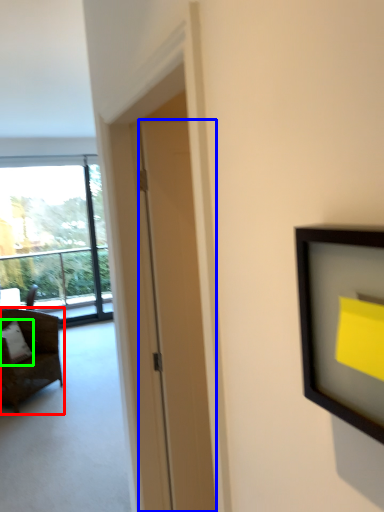
Question: Considering the real-world distances, which object is closest to chair (highlighted by a red box)? door (highlighted by a blue box) or pillow (highlighted by a green box).

Choices:
 (A) door
 (B) pillow

Answer: (B)